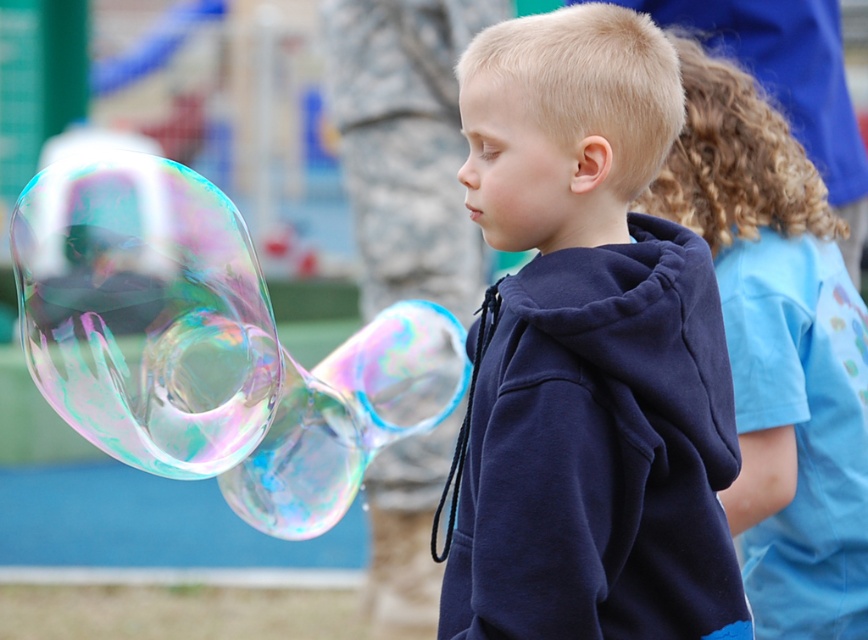
Based on the photo, is navy blue hoodie at center bigger than transparent iridescent bubbles at left?

Incorrect, navy blue hoodie at center is not larger than transparent iridescent bubbles at left.

Is navy blue hoodie at center in front of transparent iridescent bubbles at left?

Yes, it is in front of transparent iridescent bubbles at left.

Does point (641, 440) come closer to viewer compared to point (472, 301)?

Yes, point (641, 440) is in front of point (472, 301).

At what (x,y) coordinates should I click in order to perform the action: click on navy blue hoodie at center. Please return your answer as a coordinate pair (x, y). Looking at the image, I should click on (589, 353).

Does transparent iridescent bubble at left have a lesser width compared to transparent iridescent bubbles at left?

Yes, transparent iridescent bubble at left is thinner than transparent iridescent bubbles at left.

Locate an element on the screen. This screenshot has width=868, height=640. transparent iridescent bubble at left is located at coordinates (145, 312).

Find the location of `transparent iridescent bubble at left`. transparent iridescent bubble at left is located at coordinates (145, 312).

Is point (809, 588) in front of point (444, 209)?

Yes, it is.

Who is shorter, blue cotton shirt at center or transparent iridescent bubbles at left?

Standing shorter between the two is transparent iridescent bubbles at left.

At what (x,y) coordinates should I click in order to perform the action: click on blue cotton shirt at center. Please return your answer as a coordinate pair (x, y). This screenshot has height=640, width=868. Looking at the image, I should click on (778, 349).